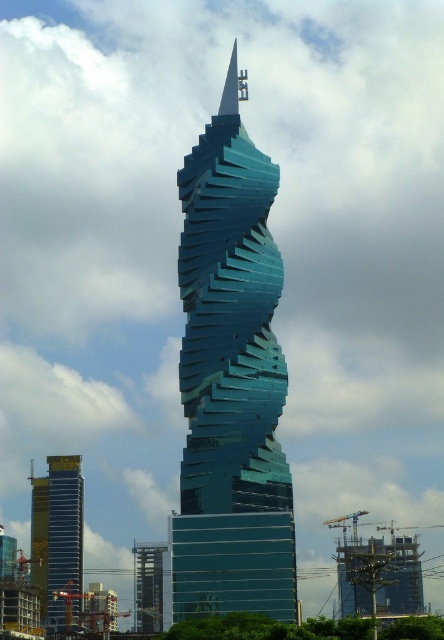
You are standing in front of the skyscraper and want to take a photo that includes both the glossy glass tower at center and the glassy teal skyscraper at center. Which one will appear larger in the photo?

The glossy glass tower at center will appear larger in the photo because it is closer to the viewer than the glassy teal skyscraper at center.

You are an architect evaluating the design of the yellow glass building at left and the glassy teal skyscraper at center. Which building would you say has a bigger footprint in terms of physical size?

The yellow glass building at left has a larger size compared to the glassy teal skyscraper at center, so it has a bigger footprint.

You are standing at the base of the skyscraper and want to take a photo of the point labeled as point [261,355]. Given that your camera can focus on objects up to 250 meters away, will you be able to capture this point clearly?

The point [261,355] is 239.34 meters away from the camera, which is within the camera focus range of 250 meters. Therefore, you can capture the point clearly.